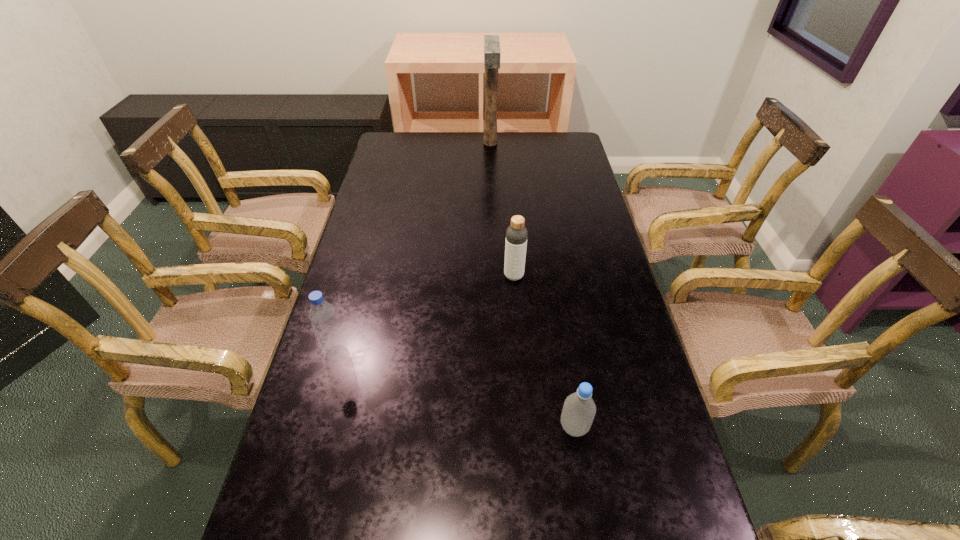
You are a GUI agent. You are given a task and a screenshot of the screen. Output one action in this format:
    pyautogui.click(x=<x>, y=<y>)
    Task: Click on the free region located on the front of the third farthest object
    
    Given the screenshot: What is the action you would take?
    pyautogui.click(x=323, y=404)

I want to click on free location located on the back of the shortest bottle, so click(553, 293).

I want to click on object situated at the far edge, so click(x=492, y=54).

Identify the location of object at the left edge. (322, 315).

Where is `vacant space at the far edge of the desktop`? This screenshot has height=540, width=960. vacant space at the far edge of the desktop is located at coordinates (451, 157).

Where is `vacant space at the left edge of the desktop`? vacant space at the left edge of the desktop is located at coordinates (343, 315).

At what (x,y) coordinates should I click in order to perform the action: click on blank space at the right edge of the desktop. Please return your answer as a coordinate pair (x, y). Image resolution: width=960 pixels, height=540 pixels. Looking at the image, I should click on (577, 301).

Where is `vacant space at the far right corner of the desktop`? vacant space at the far right corner of the desktop is located at coordinates (542, 137).

This screenshot has width=960, height=540. In order to click on vacant area that lies between the second farthest bottle and the mallet in this screenshot , I will do `click(414, 248)`.

Locate an element on the screen. The width and height of the screenshot is (960, 540). free area in between the second farthest object and the tallest object is located at coordinates (502, 210).